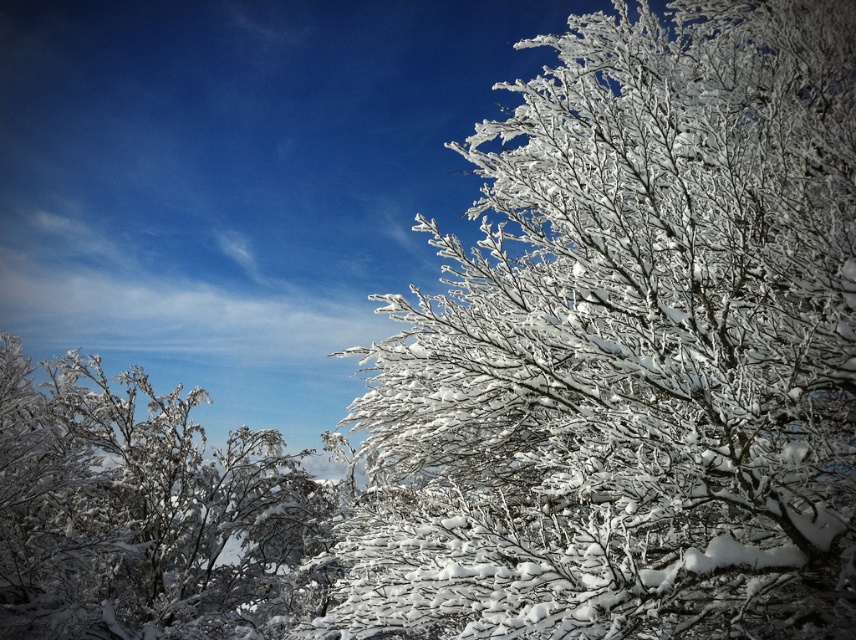
Question: Which point is closer to the camera?

Choices:
 (A) (51, 579)
 (B) (708, 51)

Answer: (B)

Question: From the image, what is the correct spatial relationship of snow-covered branches at upper right in relation to white frosty branches at left?

Choices:
 (A) below
 (B) above

Answer: (B)

Question: Where is snow-covered branches at upper right located in relation to white frosty branches at left in the image?

Choices:
 (A) right
 (B) left

Answer: (A)

Question: Can you confirm if snow-covered branches at upper right is positioned below white frosty branches at left?

Choices:
 (A) yes
 (B) no

Answer: (B)